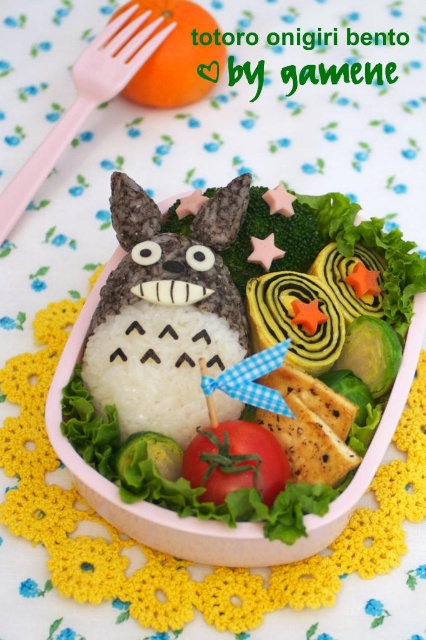
Question: Is white rice at center smaller than pink plastic fork at upper left?

Choices:
 (A) no
 (B) yes

Answer: (A)

Question: Does white matte rice at center have a greater width compared to orange matte at upper left?

Choices:
 (A) yes
 (B) no

Answer: (A)

Question: Estimate the real-world distances between objects in this image. Which object is farther from the white matte rice at center?

Choices:
 (A) pink plastic fork at upper left
 (B) white rice at center

Answer: (A)

Question: Which of the following is the closest to the observer?

Choices:
 (A) (367, 474)
 (B) (216, 35)

Answer: (A)

Question: Is white rice at center positioned at the back of red matte tomato at center?

Choices:
 (A) no
 (B) yes

Answer: (A)

Question: Considering the real-world distances, which object is closest to the orange matte at upper left?

Choices:
 (A) pink plastic fork at upper left
 (B) red matte tomato at center
 (C) white matte rice at center

Answer: (A)